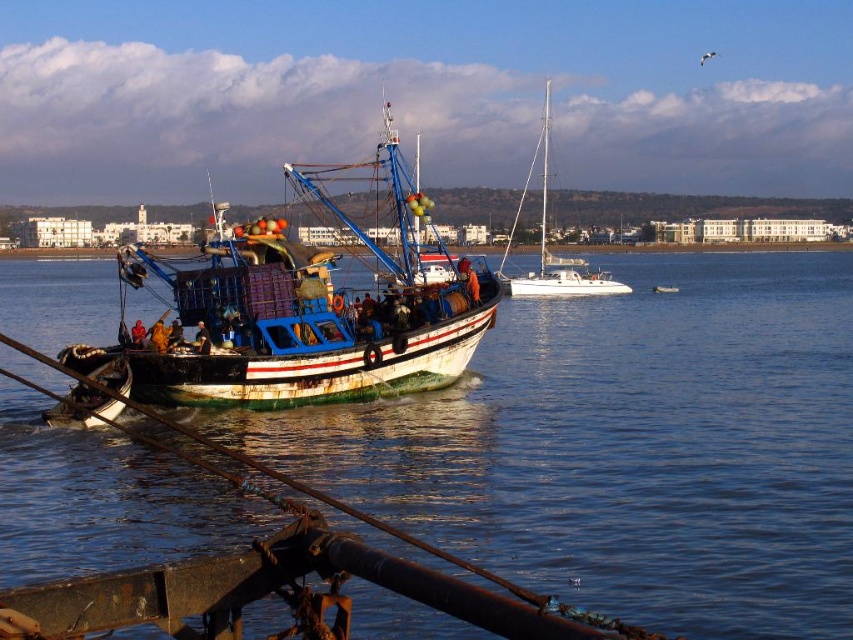
Question: Does rusty metal boat at center have a smaller size compared to white glossy sailboat at center?

Choices:
 (A) no
 (B) yes

Answer: (A)

Question: Among these objects, which one is farthest from the camera?

Choices:
 (A) blue water at center
 (B) white glossy sailboat at center
 (C) rusty metal boat at center

Answer: (B)

Question: Which point is closer to the camera taking this photo?

Choices:
 (A) (502, 538)
 (B) (315, 314)
 (C) (523, 280)

Answer: (A)

Question: From the image, what is the correct spatial relationship of blue water at center in relation to white glossy sailboat at center?

Choices:
 (A) below
 (B) above

Answer: (A)

Question: Can you confirm if blue water at center is positioned above white glossy sailboat at center?

Choices:
 (A) no
 (B) yes

Answer: (A)

Question: Estimate the real-world distances between objects in this image. Which object is farther from the rusty metal boat at center?

Choices:
 (A) blue water at center
 (B) white glossy sailboat at center

Answer: (B)